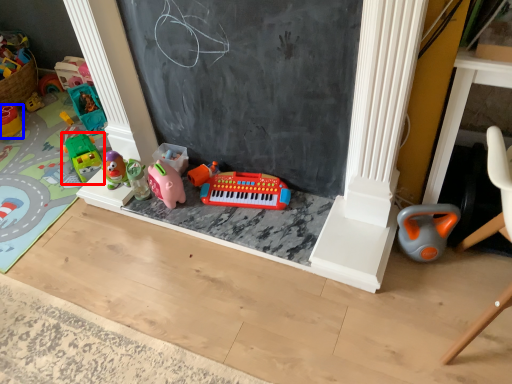
Question: Which of the following is the closest to the observer, toy (highlighted by a red box) or toy (highlighted by a blue box)?

Choices:
 (A) toy
 (B) toy

Answer: (A)